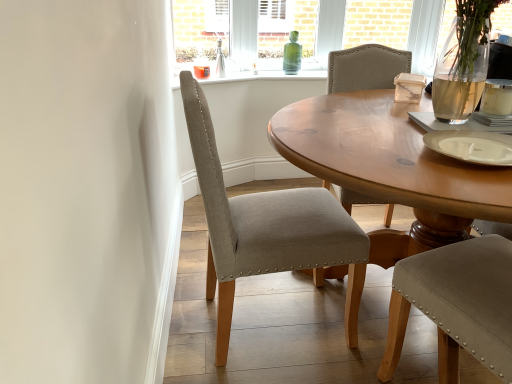
Question: From a real-world perspective, is green glass bottle at center physically above light gray fabric chair at center?

Choices:
 (A) yes
 (B) no

Answer: (A)

Question: Is green glass bottle at center bigger than light gray fabric chair at center?

Choices:
 (A) no
 (B) yes

Answer: (A)

Question: From a real-world perspective, does green glass bottle at center sit lower than light gray fabric chair at center?

Choices:
 (A) no
 (B) yes

Answer: (A)

Question: Is green glass bottle at center not near light gray fabric chair at center?

Choices:
 (A) no
 (B) yes

Answer: (B)

Question: From the image's perspective, is green glass bottle at center above light gray fabric chair at center?

Choices:
 (A) no
 (B) yes

Answer: (B)

Question: Is point (298, 69) positioned closer to the camera than point (495, 97)?

Choices:
 (A) closer
 (B) farther

Answer: (B)

Question: Is green glass bottle at center spatially inside white ceramic coffee cup at upper right, or outside of it?

Choices:
 (A) outside
 (B) inside

Answer: (A)

Question: In terms of size, does green glass bottle at center appear bigger or smaller than white ceramic coffee cup at upper right?

Choices:
 (A) big
 (B) small

Answer: (A)

Question: From a real-world perspective, relative to white ceramic coffee cup at upper right, is green glass bottle at center vertically above or below?

Choices:
 (A) above
 (B) below

Answer: (B)

Question: In terms of size, does light gray fabric chair at center appear bigger or smaller than white ceramic coffee cup at upper right?

Choices:
 (A) small
 (B) big

Answer: (B)

Question: Considering the positions of point [349, 306] and point [506, 89], is point [349, 306] closer or farther from the camera than point [506, 89]?

Choices:
 (A) farther
 (B) closer

Answer: (A)

Question: From the image's perspective, is light gray fabric chair at center positioned above or below white ceramic coffee cup at upper right?

Choices:
 (A) above
 (B) below

Answer: (B)

Question: Visually, is light gray fabric chair at center positioned to the left or to the right of white ceramic coffee cup at upper right?

Choices:
 (A) left
 (B) right

Answer: (A)

Question: Considering the positions of light gray fabric chair at center and green glass bottle at center in the image, is light gray fabric chair at center taller or shorter than green glass bottle at center?

Choices:
 (A) tall
 (B) short

Answer: (A)

Question: Is point (238, 230) positioned closer to the camera than point (286, 44)?

Choices:
 (A) closer
 (B) farther

Answer: (A)